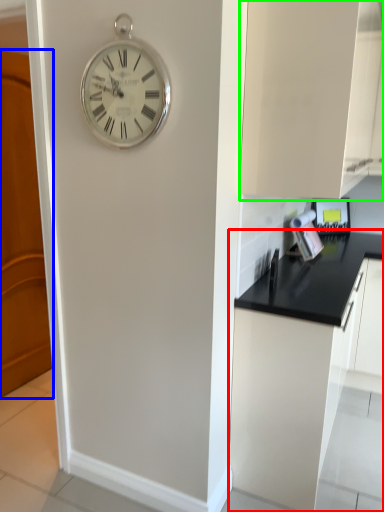
Question: Based on their relative distances, which object is nearer to cabinetry (highlighted by a red box)? Choose from door (highlighted by a blue box) and cabinetry (highlighted by a green box).

Choices:
 (A) door
 (B) cabinetry

Answer: (B)